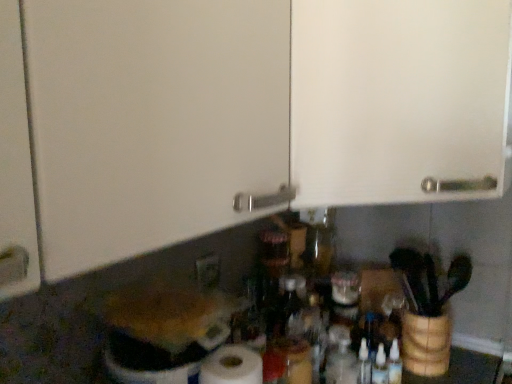
Question: In the image, is transparent plastic bottle at center positioned in front of or behind white matte cabinet door at upper center?

Choices:
 (A) behind
 (B) front

Answer: (A)

Question: Do you think transparent plastic bottle at center is within white matte cabinet door at upper center, or outside of it?

Choices:
 (A) outside
 (B) inside

Answer: (A)

Question: Estimate the real-world distances between objects in this image. Which object is closer to the transparent plastic bottle at center?

Choices:
 (A) white matte cabinet door at upper center
 (B) white matte paper towel at lower center
 (C) matte white electric outlet at lower center

Answer: (B)

Question: Which object is positioned closest to the white matte cabinet door at upper center?

Choices:
 (A) white matte paper towel at lower center
 (B) transparent plastic bottle at center
 (C) matte white electric outlet at lower center

Answer: (A)